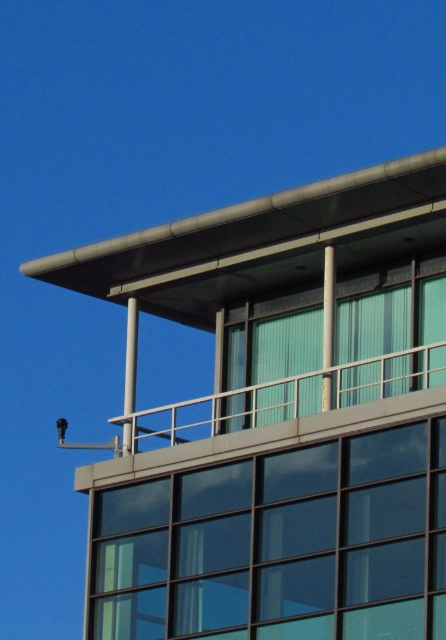
Question: Which object appears closest to the camera in this image?

Choices:
 (A) green glass window at upper center
 (B) transparent glass window at center

Answer: (B)

Question: Among these objects, which one is farthest from the camera?

Choices:
 (A) transparent glass window at center
 (B) green glass window at upper center

Answer: (B)

Question: Observing the image, what is the correct spatial positioning of transparent glass window at center in reference to green glass window at upper center?

Choices:
 (A) left
 (B) right

Answer: (A)

Question: Observing the image, what is the correct spatial positioning of transparent glass window at center in reference to green glass window at upper center?

Choices:
 (A) left
 (B) right

Answer: (A)

Question: Does transparent glass window at center appear under green glass window at upper center?

Choices:
 (A) no
 (B) yes

Answer: (B)